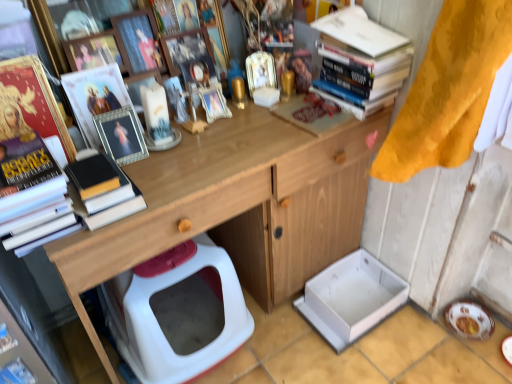
Question: From the image's perspective, is matte plastic toy at upper center above wooden at upper center?

Choices:
 (A) no
 (B) yes

Answer: (B)

Question: Considering the relative sizes of matte plastic toy at upper center and wooden at upper center in the image provided, is matte plastic toy at upper center smaller than wooden at upper center?

Choices:
 (A) no
 (B) yes

Answer: (B)

Question: Is matte plastic toy at upper center not close to wooden at upper center?

Choices:
 (A) yes
 (B) no

Answer: (B)

Question: Is matte plastic toy at upper center shorter than wooden at upper center?

Choices:
 (A) yes
 (B) no

Answer: (A)

Question: From the image's perspective, is matte plastic toy at upper center located beneath wooden at upper center?

Choices:
 (A) yes
 (B) no

Answer: (B)

Question: Considering the positions of point (333, 297) and point (157, 286), is point (333, 297) closer or farther from the camera than point (157, 286)?

Choices:
 (A) closer
 (B) farther

Answer: (B)

Question: In terms of size, does white cardboard box at lower center appear bigger or smaller than white plastic toilet at lower center?

Choices:
 (A) small
 (B) big

Answer: (A)

Question: Relative to white plastic toilet at lower center, is white cardboard box at lower center in front or behind?

Choices:
 (A) front
 (B) behind

Answer: (B)

Question: From a real-world perspective, relative to white plastic toilet at lower center, is white cardboard box at lower center vertically above or below?

Choices:
 (A) below
 (B) above

Answer: (A)

Question: From a real-world perspective, is metallic silver picture frame at upper center, the second picture frame ordered from the bottom, physically located above or below metallic silver photo frame at upper center?

Choices:
 (A) above
 (B) below

Answer: (A)

Question: Is metallic silver picture frame at upper center, which is the 3th picture frame in top-to-bottom order, inside the boundaries of metallic silver photo frame at upper center, or outside?

Choices:
 (A) outside
 (B) inside

Answer: (A)

Question: Considering the positions of metallic silver picture frame at upper center, which is the 3th picture frame in top-to-bottom order, and metallic silver photo frame at upper center in the image, is metallic silver picture frame at upper center, which is the 3th picture frame in top-to-bottom order, wider or thinner than metallic silver photo frame at upper center?

Choices:
 (A) wide
 (B) thin

Answer: (B)

Question: Is metallic silver picture frame at upper center, which is the 3th picture frame in top-to-bottom order, taller or shorter than metallic silver photo frame at upper center?

Choices:
 (A) tall
 (B) short

Answer: (B)

Question: Considering the positions of point (112, 281) and point (242, 97), is point (112, 281) closer or farther from the camera than point (242, 97)?

Choices:
 (A) closer
 (B) farther

Answer: (A)

Question: From the image's perspective, relative to gold metallic bottle at center, is white plastic toilet at lower center above or below?

Choices:
 (A) above
 (B) below

Answer: (B)